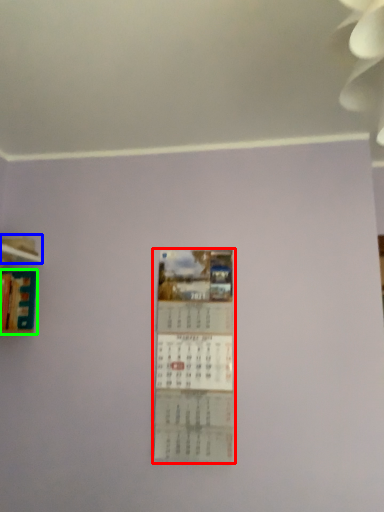
Question: Based on their relative distances, which object is nearer to poster (highlighted by a red box)? Choose from shelf (highlighted by a blue box) and book (highlighted by a green box).

Choices:
 (A) shelf
 (B) book

Answer: (B)